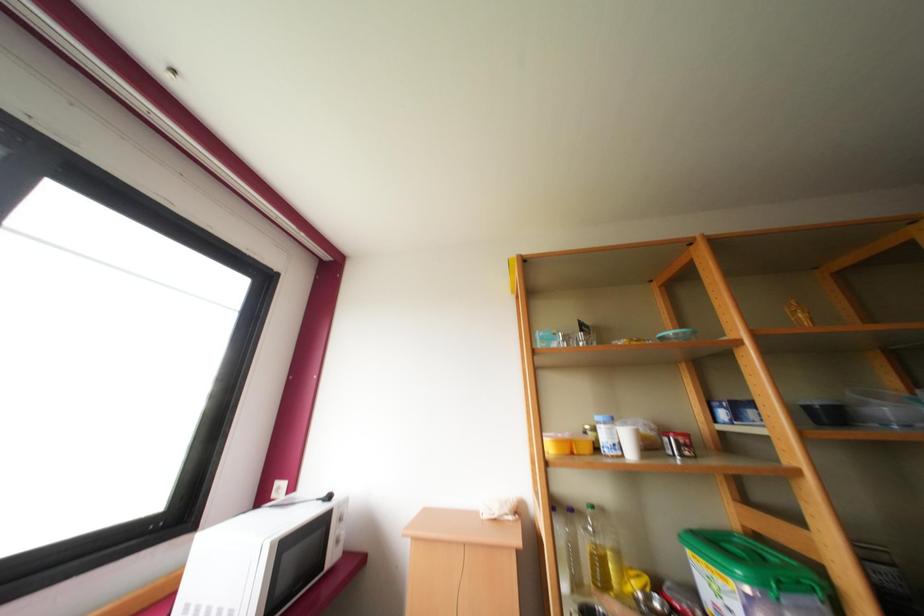
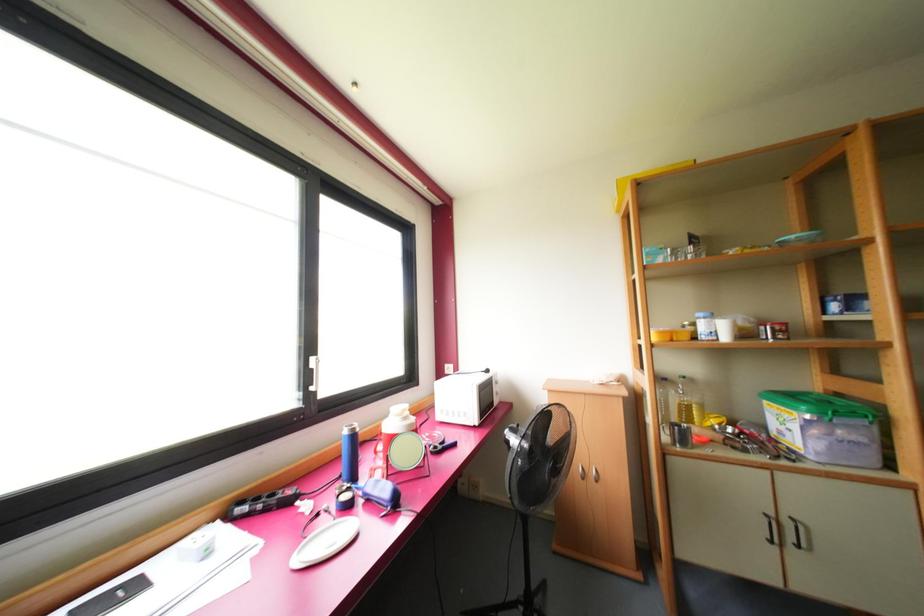
The images are taken continuously from a first-person perspective. In which direction is your viewpoint rotating?

The rotation direction of the camera is left-down.